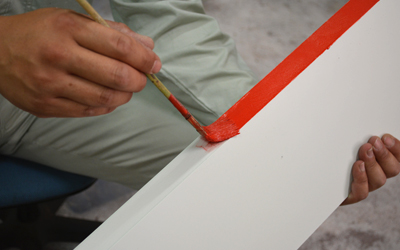
Image resolution: width=400 pixels, height=250 pixels. I want to click on red paint stripe, so click(x=283, y=73).